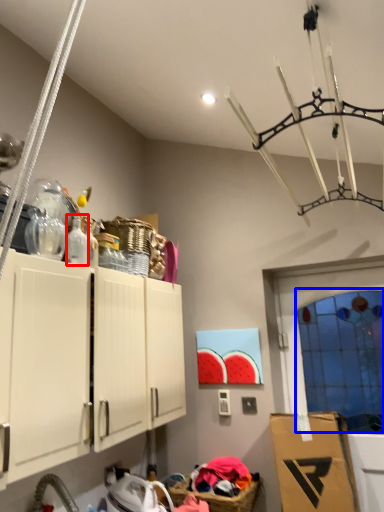
Question: Which object appears farthest to the camera in this image, bottle (highlighted by a red box) or glass door (highlighted by a blue box)?

Choices:
 (A) bottle
 (B) glass door

Answer: (B)